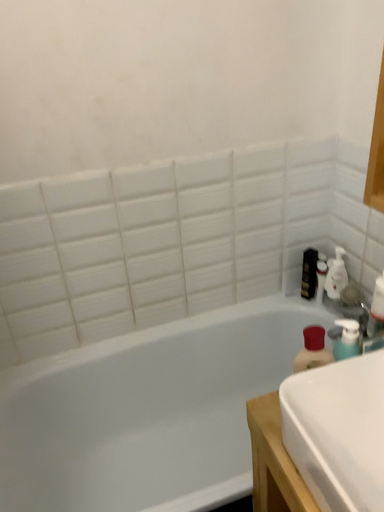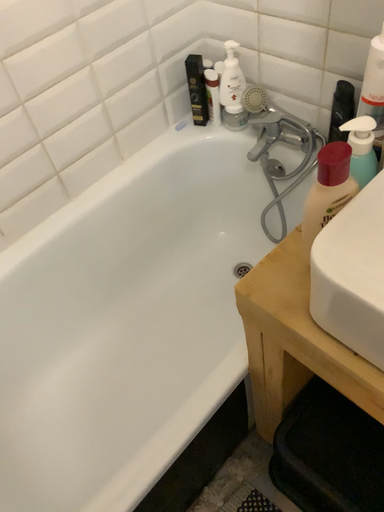
Question: How did the camera likely rotate when shooting the video?

Choices:
 (A) rotated left
 (B) rotated right

Answer: (B)